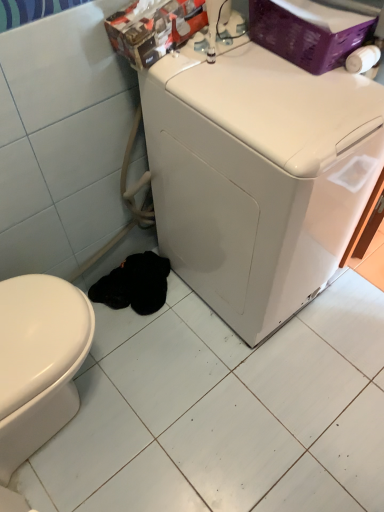
In the scene shown: What is the approximate height of white glossy washing machine at center?

white glossy washing machine at center is 35.49 inches in height.

The image size is (384, 512). What do you see at coordinates (257, 175) in the screenshot?
I see `white glossy washing machine at center` at bounding box center [257, 175].

The height and width of the screenshot is (512, 384). I want to click on white glossy washing machine at center, so click(x=257, y=175).

Where is `white glossy ceramic tile at lower center`? white glossy ceramic tile at lower center is located at coordinates (225, 411).

The width and height of the screenshot is (384, 512). What do you see at coordinates (225, 411) in the screenshot?
I see `white glossy ceramic tile at lower center` at bounding box center [225, 411].

You are a GUI agent. You are given a task and a screenshot of the screen. Output one action in this format:
    pyautogui.click(x=<x>, y=<y>)
    Task: Click on the white glossy washing machine at center
    
    Given the screenshot: What is the action you would take?
    coord(257,175)

Between white glossy washing machine at center and white glossy ceramic tile at lower center, which one appears on the left side from the viewer's perspective?

Positioned to the left is white glossy ceramic tile at lower center.

Looking at this image, does white glossy washing machine at center lie behind white glossy ceramic tile at lower center?

No, white glossy washing machine at center is closer to the camera.

Which is in front, point (268, 191) or point (314, 362)?

The point (268, 191) is closer.

From the image's perspective, between white glossy washing machine at center and white glossy ceramic tile at lower center, which one is located above?

white glossy washing machine at center appears higher in the image.

From a real-world perspective, is white glossy washing machine at center above or below white glossy ceramic tile at lower center?

In terms of real-world spatial position, white glossy washing machine at center is above white glossy ceramic tile at lower center.

Considering the relative sizes of white glossy washing machine at center and white glossy ceramic tile at lower center in the image provided, is white glossy washing machine at center wider than white glossy ceramic tile at lower center?

No.

Looking at this image, which of these two, white glossy washing machine at center or white glossy ceramic tile at lower center, stands taller?

With more height is white glossy washing machine at center.

From the picture: Between white glossy washing machine at center and white glossy ceramic tile at lower center, which one has smaller size?

Smaller between the two is white glossy ceramic tile at lower center.

Choose the correct answer: Is white glossy washing machine at center inside white glossy ceramic tile at lower center or outside it?

white glossy washing machine at center cannot be found inside white glossy ceramic tile at lower center.

Is white glossy washing machine at center positioned far away from white glossy ceramic tile at lower center?

No, white glossy washing machine at center is not far away from white glossy ceramic tile at lower center.

Is white glossy washing machine at center facing away from white glossy ceramic tile at lower center?

No, white glossy washing machine at center is not facing away from white glossy ceramic tile at lower center.

How distant is white glossy washing machine at center from white glossy ceramic tile at lower center?

white glossy washing machine at center and white glossy ceramic tile at lower center are 20.57 inches apart.

Identify the location of washing machine that is in front of the white glossy ceramic tile at lower center. This screenshot has width=384, height=512. (257, 175).

Based on their positions, is white glossy ceramic tile at lower center located to the left or right of white glossy washing machine at center?

Based on their positions, white glossy ceramic tile at lower center is located to the left of white glossy washing machine at center.

Which is behind, white glossy ceramic tile at lower center or white glossy washing machine at center?

white glossy ceramic tile at lower center is behind.

Does point (247, 360) lie in front of point (225, 156)?

No, (247, 360) is further to viewer.

From the image's perspective, which one is positioned higher, white glossy ceramic tile at lower center or white glossy washing machine at center?

white glossy washing machine at center, from the image's perspective.

From a real-world perspective, which object stands above the other?

From a 3D spatial view, white glossy washing machine at center is above.

Does white glossy ceramic tile at lower center have a greater width compared to white glossy washing machine at center?

Indeed, white glossy ceramic tile at lower center has a greater width compared to white glossy washing machine at center.

Considering the sizes of objects white glossy ceramic tile at lower center and white glossy washing machine at center in the image provided, who is taller, white glossy ceramic tile at lower center or white glossy washing machine at center?

white glossy washing machine at center is taller.

Between white glossy ceramic tile at lower center and white glossy washing machine at center, which one has smaller size?

Smaller between the two is white glossy ceramic tile at lower center.

Is white glossy ceramic tile at lower center outside of white glossy washing machine at center?

Yes, white glossy ceramic tile at lower center is outside of white glossy washing machine at center.

Is white glossy ceramic tile at lower center in contact with white glossy washing machine at center?

white glossy ceramic tile at lower center is not next to white glossy washing machine at center, and they're not touching.

Is white glossy ceramic tile at lower center turned away from white glossy washing machine at center?

No, white glossy ceramic tile at lower center's orientation is not away from white glossy washing machine at center.

Locate an element on the screen. This screenshot has width=384, height=512. ceramic tile to the left of white glossy washing machine at center is located at coordinates coord(225,411).

Image resolution: width=384 pixels, height=512 pixels. Find the location of `washing machine on the right side of white glossy ceramic tile at lower center`. washing machine on the right side of white glossy ceramic tile at lower center is located at coordinates (257, 175).

This screenshot has width=384, height=512. I want to click on ceramic tile that appears on the left of white glossy washing machine at center, so click(225, 411).